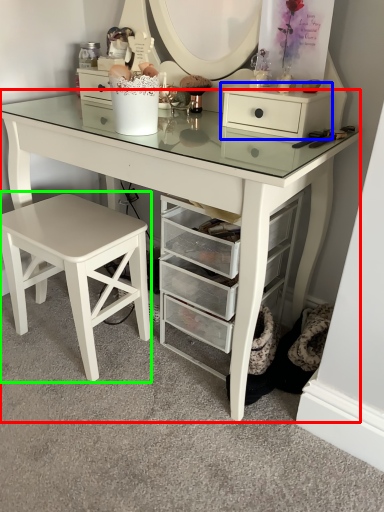
Question: Which object is the farthest from table (highlighted by a red box)? Choose among these: chest of drawers (highlighted by a blue box) or stool (highlighted by a green box).

Choices:
 (A) chest of drawers
 (B) stool

Answer: (B)